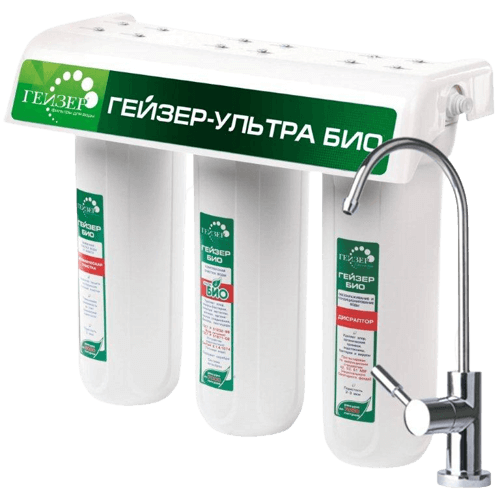
Identify the location of canister. (115, 290), (280, 391), (370, 347).